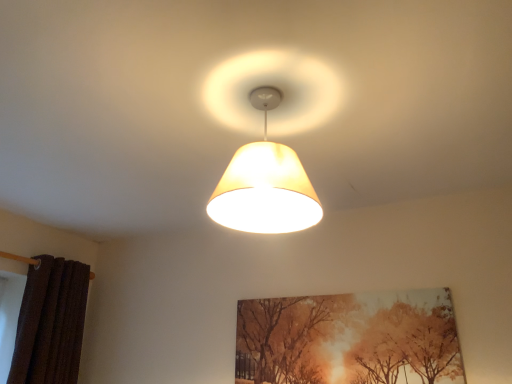
Question: Is brown textured curtain at left taller than matte beige lampshade at center?

Choices:
 (A) yes
 (B) no

Answer: (A)

Question: Is brown textured curtain at left positioned beyond the bounds of matte beige lampshade at center?

Choices:
 (A) yes
 (B) no

Answer: (A)

Question: Is brown textured curtain at left bigger than matte beige lampshade at center?

Choices:
 (A) no
 (B) yes

Answer: (B)

Question: Is brown textured curtain at left far from matte beige lampshade at center?

Choices:
 (A) no
 (B) yes

Answer: (B)

Question: Considering the relative positions of brown textured curtain at left and matte beige lampshade at center in the image provided, is brown textured curtain at left in front of matte beige lampshade at center?

Choices:
 (A) no
 (B) yes

Answer: (A)

Question: Does brown textured curtain at left appear on the left side of matte beige lampshade at center?

Choices:
 (A) no
 (B) yes

Answer: (B)

Question: Can you confirm if brown textured curtain at left is smaller than matte canvas painting at center?

Choices:
 (A) yes
 (B) no

Answer: (B)

Question: Considering the relative sizes of brown textured curtain at left and matte canvas painting at center in the image provided, is brown textured curtain at left wider than matte canvas painting at center?

Choices:
 (A) yes
 (B) no

Answer: (A)

Question: Is brown textured curtain at left aimed at matte canvas painting at center?

Choices:
 (A) no
 (B) yes

Answer: (B)

Question: Can you confirm if brown textured curtain at left is bigger than matte canvas painting at center?

Choices:
 (A) yes
 (B) no

Answer: (A)

Question: Can matte canvas painting at center be found inside brown textured curtain at left?

Choices:
 (A) no
 (B) yes

Answer: (A)

Question: From the image's perspective, does brown textured curtain at left appear higher than matte canvas painting at center?

Choices:
 (A) yes
 (B) no

Answer: (B)

Question: From the image's perspective, is matte beige lampshade at center beneath matte canvas painting at center?

Choices:
 (A) yes
 (B) no

Answer: (B)